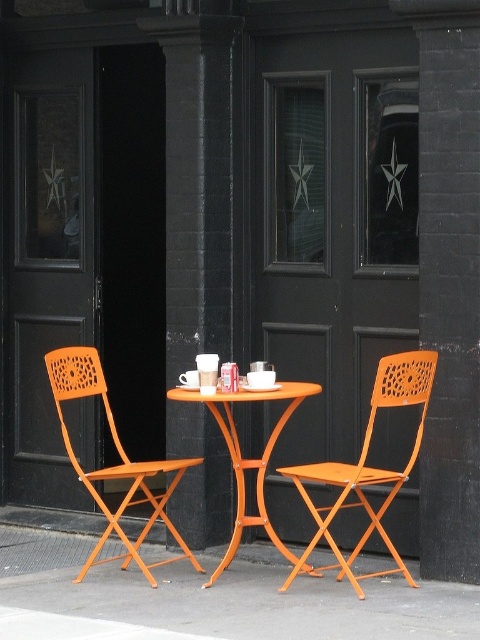
How far apart are orange wood pavement at lower center and orange wood table at center?

orange wood pavement at lower center and orange wood table at center are 27.26 inches apart from each other.

Consider the image. Which of these two, orange wood pavement at lower center or orange wood table at center, stands taller?

orange wood table at center

Who is more distant from viewer, (479, 636) or (267, 525)?

The point (267, 525) is behind.

Locate an element on the screen. orange wood pavement at lower center is located at coordinates (210, 600).

Which is above, orange wood pavement at lower center or orange plastic chair at left?

orange plastic chair at left

Does orange wood pavement at lower center have a greater height compared to orange plastic chair at left?

Incorrect, orange wood pavement at lower center's height is not larger of orange plastic chair at left's.

Measure the distance between orange wood pavement at lower center and camera.

orange wood pavement at lower center and camera are 5.18 meters apart from each other.

The image size is (480, 640). What are the coordinates of `orange wood pavement at lower center` in the screenshot? It's located at (210, 600).

Does orange plastic chair at left have a greater width compared to orange wood table at center?

Indeed, orange plastic chair at left has a greater width compared to orange wood table at center.

Locate an element on the screen. This screenshot has height=640, width=480. orange plastic chair at left is located at coordinates (113, 465).

Is point (134, 476) positioned in front of point (277, 388)?

Yes, point (134, 476) is in front of point (277, 388).

Locate an element on the screen. The image size is (480, 640). orange plastic chair at left is located at coordinates (113, 465).